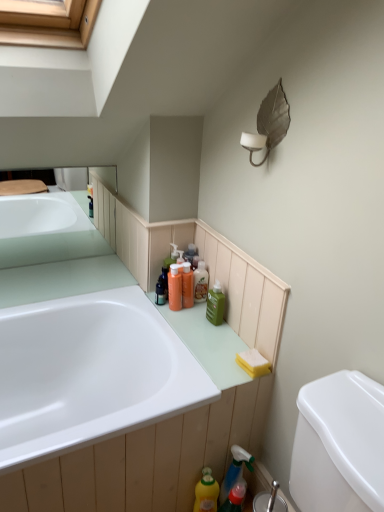
Question: Is metallic leaf-shaped light fixture at upper right not within yellow sponge at lower right?

Choices:
 (A) yes
 (B) no

Answer: (A)

Question: Can you confirm if metallic leaf-shaped light fixture at upper right is positioned to the left of yellow sponge at lower right?

Choices:
 (A) yes
 (B) no

Answer: (A)

Question: Is the depth of metallic leaf-shaped light fixture at upper right greater than that of yellow sponge at lower right?

Choices:
 (A) no
 (B) yes

Answer: (A)

Question: Could yellow sponge at lower right be considered to be inside metallic leaf-shaped light fixture at upper right?

Choices:
 (A) yes
 (B) no

Answer: (B)

Question: From the image's perspective, is metallic leaf-shaped light fixture at upper right located above yellow sponge at lower right?

Choices:
 (A) no
 (B) yes

Answer: (B)

Question: Is point (180, 275) closer or farther from the camera than point (253, 369)?

Choices:
 (A) closer
 (B) farther

Answer: (B)

Question: Is orange plastic bottles at center, which is the first toiletry from left to right, inside or outside of yellow sponge at lower right?

Choices:
 (A) outside
 (B) inside

Answer: (A)

Question: From a real-world perspective, relative to yellow sponge at lower right, is orange plastic bottles at center, which is the first toiletry from left to right, vertically above or below?

Choices:
 (A) below
 (B) above

Answer: (B)

Question: From the image's perspective, is orange plastic bottles at center, which is the first toiletry from left to right, above or below yellow sponge at lower right?

Choices:
 (A) below
 (B) above

Answer: (B)

Question: Would you say translucent orange bottle at center, positioned as the 1th toiletry in right-to-left order, is to the left or to the right of white glossy bathtub at lower left in the picture?

Choices:
 (A) left
 (B) right

Answer: (B)

Question: Looking at the image, does translucent orange bottle at center, positioned as the 1th toiletry in right-to-left order, seem bigger or smaller compared to white glossy bathtub at lower left?

Choices:
 (A) small
 (B) big

Answer: (A)

Question: Is translucent orange bottle at center, which is the 2th toiletry from left to right, in front of or behind white glossy bathtub at lower left in the image?

Choices:
 (A) behind
 (B) front

Answer: (A)

Question: Considering the positions of translucent orange bottle at center, positioned as the 1th toiletry in right-to-left order, and white glossy bathtub at lower left in the image, is translucent orange bottle at center, positioned as the 1th toiletry in right-to-left order, taller or shorter than white glossy bathtub at lower left?

Choices:
 (A) tall
 (B) short

Answer: (B)

Question: From the image's perspective, is metallic leaf-shaped light fixture at upper right located above or below translucent plastic spray bottle at lower center, the 2th cleaning product ordered from the bottom?

Choices:
 (A) above
 (B) below

Answer: (A)

Question: Considering the positions of metallic leaf-shaped light fixture at upper right and translucent plastic spray bottle at lower center, the 2th cleaning product ordered from the bottom, in the image, is metallic leaf-shaped light fixture at upper right taller or shorter than translucent plastic spray bottle at lower center, the 2th cleaning product ordered from the bottom,?

Choices:
 (A) tall
 (B) short

Answer: (B)